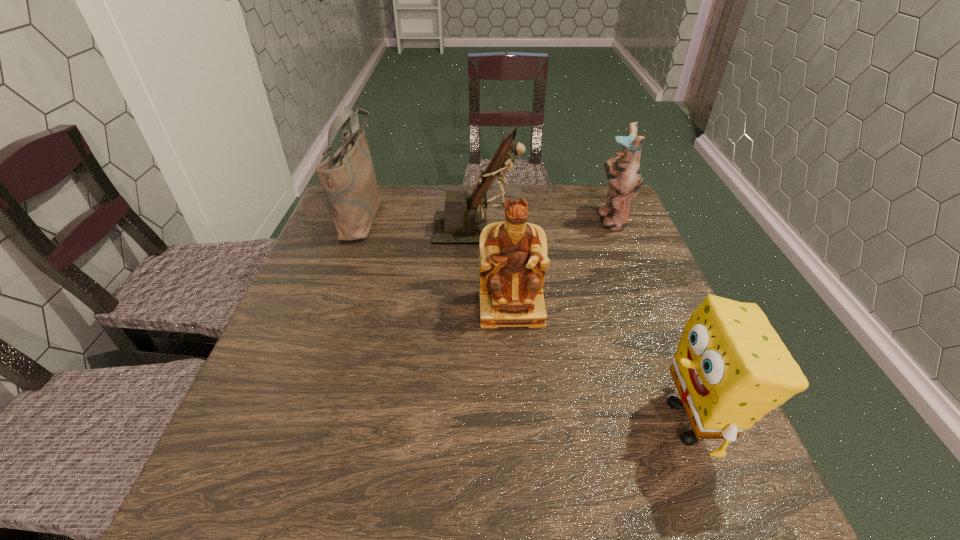
In order to click on vacant space situated 0.180m on the face of the nearest object in this screenshot , I will do `click(553, 422)`.

The image size is (960, 540). In order to click on vacant area located 0.150m on the face of the nearest object in this screenshot , I will do `click(570, 422)`.

I want to click on shoulder bag located at the far edge, so coord(347,178).

The width and height of the screenshot is (960, 540). In order to click on object present at the left edge in this screenshot , I will do `click(347, 178)`.

The image size is (960, 540). I want to click on figurine at the right edge, so click(x=623, y=172).

The height and width of the screenshot is (540, 960). I want to click on sponge that is at the right edge, so click(x=731, y=368).

The image size is (960, 540). Find the location of `object that is at the far left corner`. object that is at the far left corner is located at coordinates click(x=347, y=178).

At what (x,y) coordinates should I click in order to perform the action: click on object at the far right corner. Please return your answer as a coordinate pair (x, y). The height and width of the screenshot is (540, 960). Looking at the image, I should click on (623, 172).

Identify the location of vacant space at the far edge of the desktop. (389, 219).

Where is `vacant space at the near edge of the desktop`? vacant space at the near edge of the desktop is located at coordinates (498, 478).